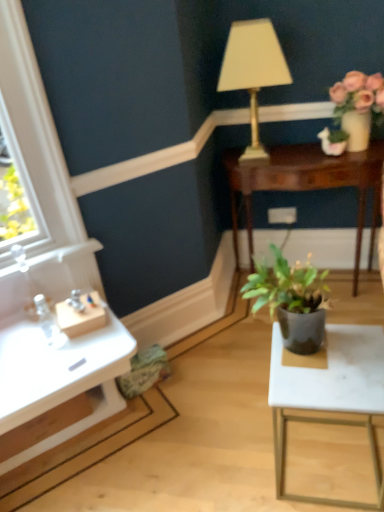
This screenshot has width=384, height=512. Identify the location of empty space that is in between white marble table at lower right, which ranks as the first table in front-to-back order, and green fabric swivel chair at lower center. (209, 422).